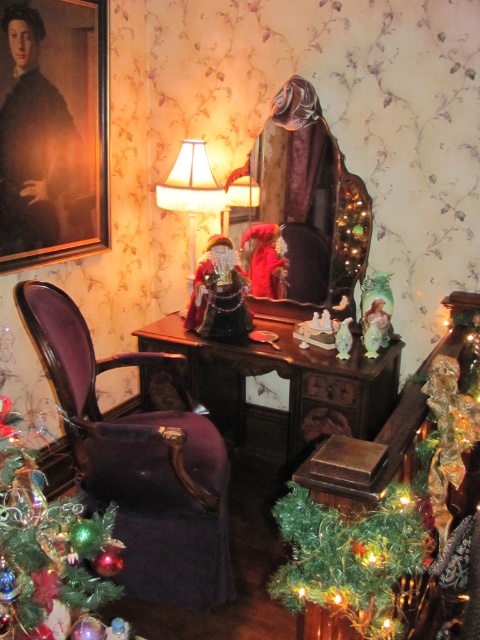
Which of these two, shiny green garland at center or matte cream lampshade at center, stands taller?

shiny green garland at center is taller.

Which is more to the left, shiny green garland at center or matte cream lampshade at center?

matte cream lampshade at center is more to the left.

From the picture: Measure the distance between shiny green garland at center and camera.

shiny green garland at center and camera are 4.09 feet apart from each other.

I want to click on shiny green garland at center, so click(x=372, y=509).

From the picture: Is dark wood desk at center shorter than shiny green christmas tree at left?

In fact, dark wood desk at center may be taller than shiny green christmas tree at left.

Who is taller, dark wood desk at center or shiny green christmas tree at left?

dark wood desk at center is taller.

What are the coordinates of `dark wood desk at center` in the screenshot? It's located at (288, 385).

You are a GUI agent. You are given a task and a screenshot of the screen. Output one action in this format:
    pyautogui.click(x=<x>, y=<y>)
    Task: Click on the dark wood desk at center
    
    Given the screenshot: What is the action you would take?
    pyautogui.click(x=288, y=385)

Image resolution: width=480 pixels, height=640 pixels. I want to click on dark wood desk at center, so click(288, 385).

Does dark wood desk at center appear on the left side of shiny green plastic tree at lower right?

Correct, you'll find dark wood desk at center to the left of shiny green plastic tree at lower right.

Who is more forward, (324, 387) or (303, 518)?

Point (303, 518) is in front.

This screenshot has width=480, height=640. I want to click on dark wood desk at center, so click(x=288, y=385).